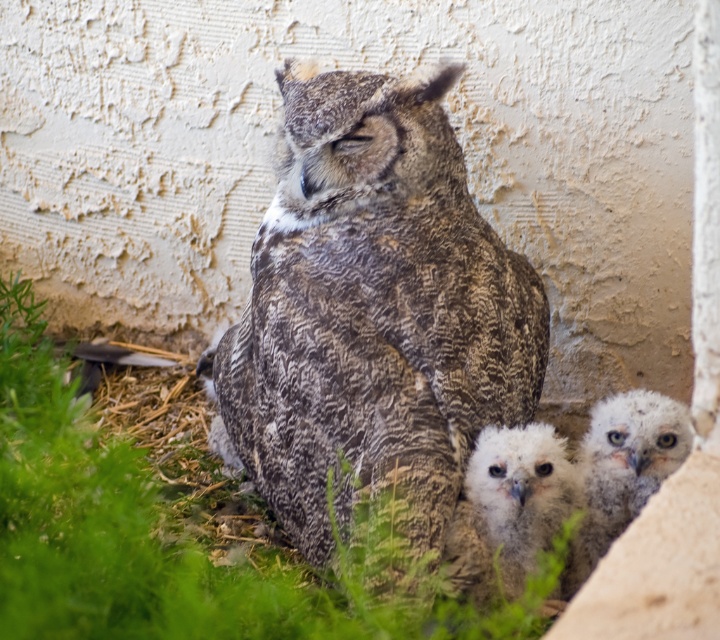
What do you see at coordinates (374, 314) in the screenshot?
I see `speckled feathered owl at center` at bounding box center [374, 314].

Is speckled feathered owl at center thinner than fluffy white owl at lower center?

In fact, speckled feathered owl at center might be wider than fluffy white owl at lower center.

Does point (516, 355) lie in front of point (464, 520)?

No, (516, 355) is further to viewer.

Identify the location of speckled feathered owl at center. This screenshot has height=640, width=720. (374, 314).

Can you confirm if speckled feathered owl at center is bigger than white fluffy owl at lower right?

Indeed, speckled feathered owl at center has a larger size compared to white fluffy owl at lower right.

Which is more to the right, speckled feathered owl at center or white fluffy owl at lower right?

white fluffy owl at lower right

Which is behind, point (366, 172) or point (598, 458)?

Point (366, 172)

Where is `speckled feathered owl at center`? speckled feathered owl at center is located at coordinates (374, 314).

Who is higher up, fluffy white owl at lower center or white fluffy owl at lower right?

white fluffy owl at lower right is above.

Is fluffy white owl at lower center below white fluffy owl at lower right?

Yes.

Describe the element at coordinates (508, 508) in the screenshot. I see `fluffy white owl at lower center` at that location.

Where is `fluffy white owl at lower center`? The height and width of the screenshot is (640, 720). fluffy white owl at lower center is located at coordinates (508, 508).